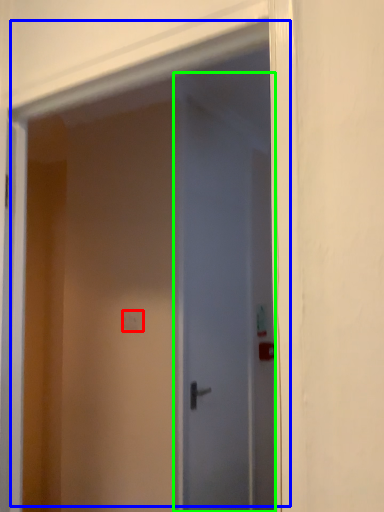
Question: Estimate the real-world distances between objects in this image. Which object is farther from light switch (highlighted by a red box), door (highlighted by a blue box) or door (highlighted by a green box)?

Choices:
 (A) door
 (B) door

Answer: (A)